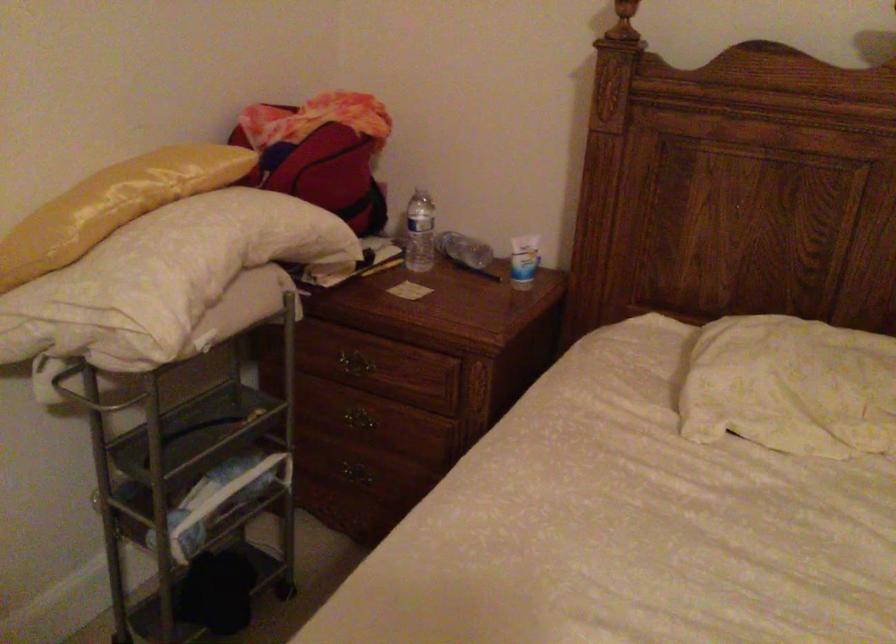
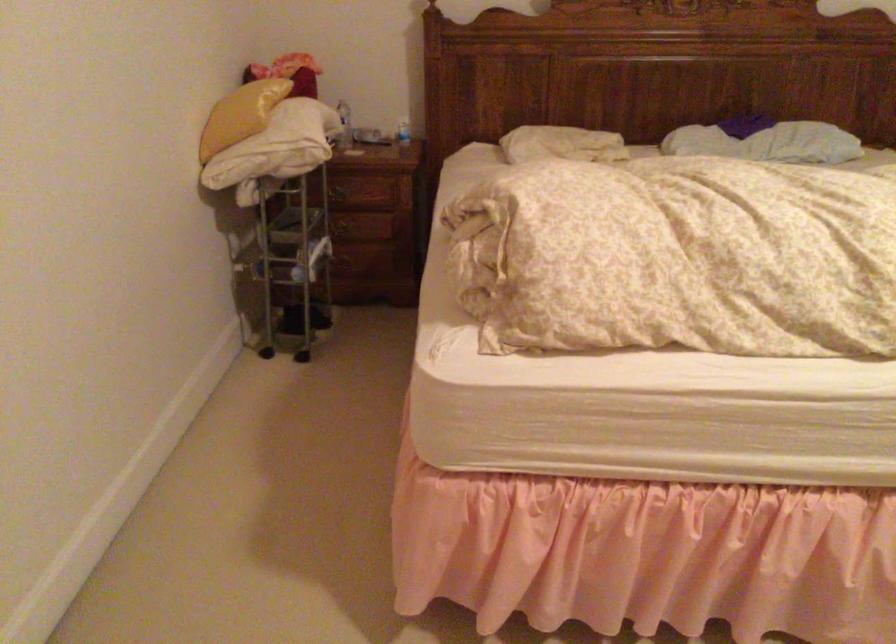
Find the pixel in the second image that matches (x=348, y=363) in the first image.

(338, 194)